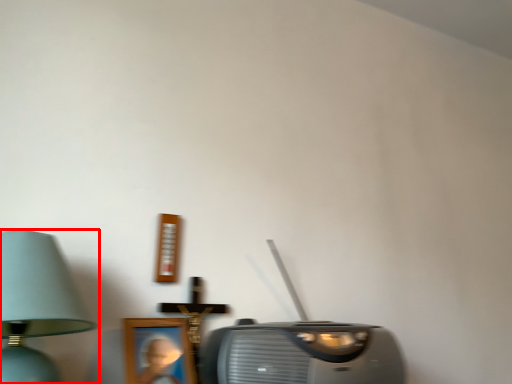
Question: From the image's perspective, where is lamp (annotated by the red box) located relative to stereo?

Choices:
 (A) above
 (B) below

Answer: (A)